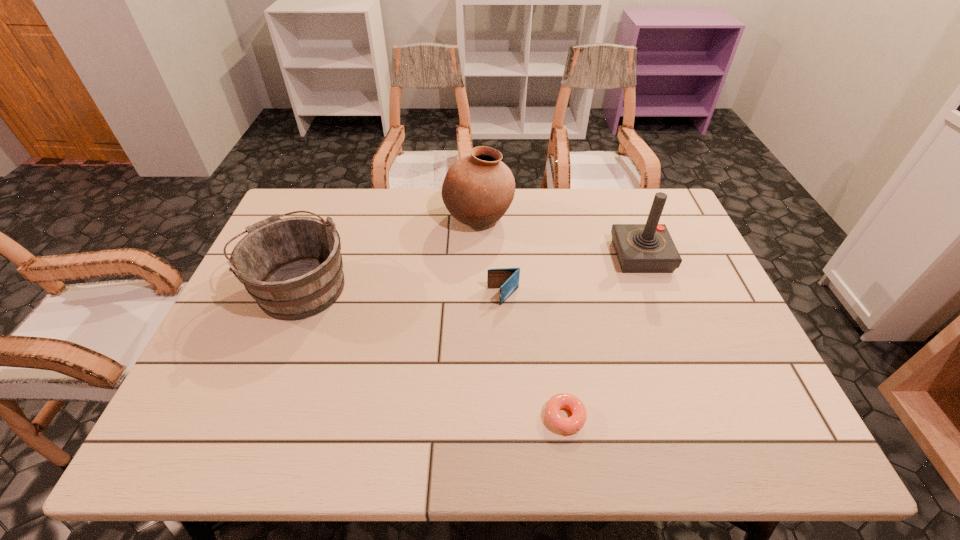
You are a GUI agent. You are given a task and a screenshot of the screen. Output one action in this format:
    pyautogui.click(x=<x>, y=<y>)
    Task: Click on the pottery
    The image size is (960, 540).
    Given the screenshot: What is the action you would take?
    pyautogui.click(x=478, y=189)

At what (x,y) coordinates should I click in order to perform the action: click on joystick. Please return your answer as a coordinate pair (x, y). Looking at the image, I should click on (640, 248).

At what (x,y) coordinates should I click in order to perform the action: click on wine bucket. Please return your answer as a coordinate pair (x, y). Looking at the image, I should click on (293, 268).

Locate an element on the screen. Image resolution: width=960 pixels, height=540 pixels. the leftmost object is located at coordinates (293, 268).

Locate an element on the screen. the second shortest object is located at coordinates (507, 279).

Locate an element on the screen. doughnut is located at coordinates (567, 425).

At what (x,y) coordinates should I click in order to perform the action: click on the fourth object from left to right. Please return your answer as a coordinate pair (x, y). This screenshot has height=540, width=960. Looking at the image, I should click on (567, 425).

Locate an element on the screen. The image size is (960, 540). free space located 0.370m on the right of the pottery is located at coordinates (628, 219).

You are a GUI agent. You are given a task and a screenshot of the screen. Output one action in this format:
    pyautogui.click(x=<x>, y=<y>)
    Task: Click on the free space located 0.290m on the rectangular base of the rightmost object
    The height and width of the screenshot is (540, 960).
    Given the screenshot: What is the action you would take?
    pyautogui.click(x=516, y=256)

This screenshot has width=960, height=540. I want to click on free space located on the rectangular base of the rightmost object, so click(x=540, y=256).